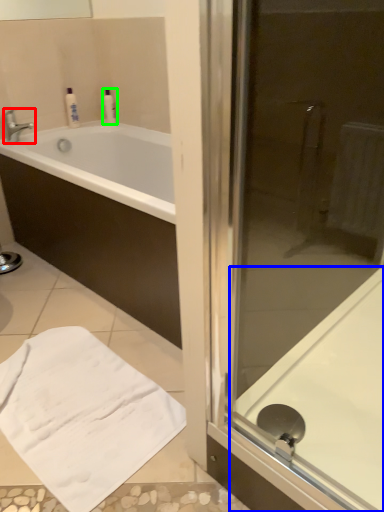
Question: Estimate the real-world distances between objects in this image. Which object is closer to tap (highlighted by a red box), bath (highlighted by a blue box) or toiletry (highlighted by a green box)?

Choices:
 (A) bath
 (B) toiletry

Answer: (B)